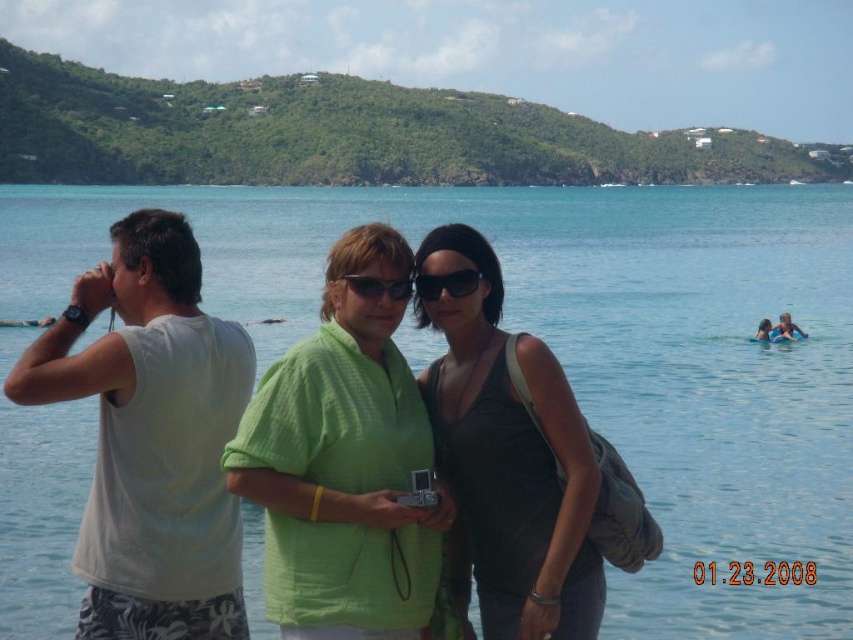
You are a photographer trying to capture a group photo. You notice the white cotton shirt at left and the black plastic sunglasses at center in your frame. Which object should you adjust to ensure both are clearly visible in the photo?

The white cotton shirt at left is larger in size than the black plastic sunglasses at center, so you should adjust the position of the white cotton shirt at left to ensure both are clearly visible in the photo.

You are taking a photo of the beach scene. You notice two points in the image at coordinates point (221, 360) and point (345, 326). Which point is closer to the camera?

Point (221, 360) is further to the camera than point (345, 326), so the closer point to the camera is point (345, 326).

In the beach scene, there are two items of clothing and a body of water. The clear blue water at center and the black matte tank top at center are both in the image. Which one is positioned to the right of the other?

The clear blue water at center is to the right of black matte tank top at center.